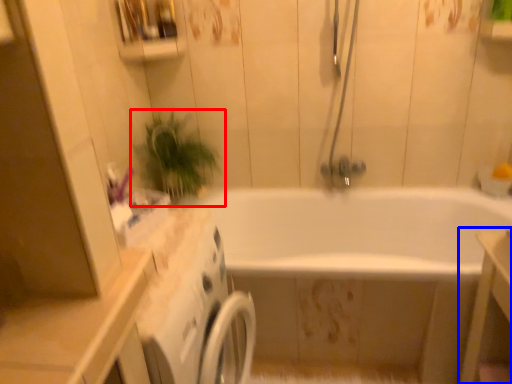
Question: Which object is further to the camera taking this photo, houseplant (highlighted by a red box) or vanity (highlighted by a blue box)?

Choices:
 (A) houseplant
 (B) vanity

Answer: (A)